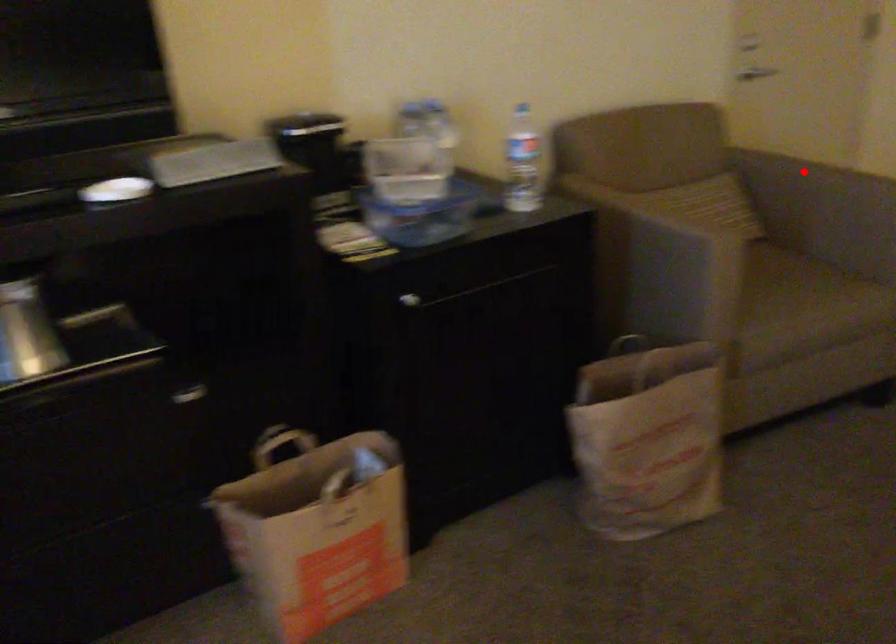
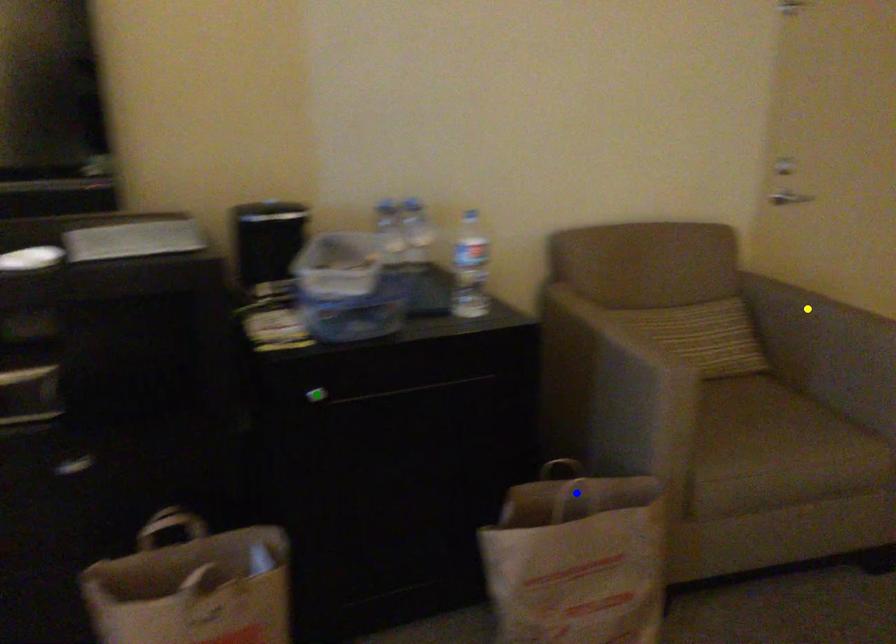
Question: I am providing you with two images of the same scene from different viewpoints. A red point is marked on the first image. You are given multiple points on the second image. Which point in image 2 is actually the same real-world point as the red point in image 1?

Choices:
 (A) green point
 (B) yellow point
 (C) blue point

Answer: (B)